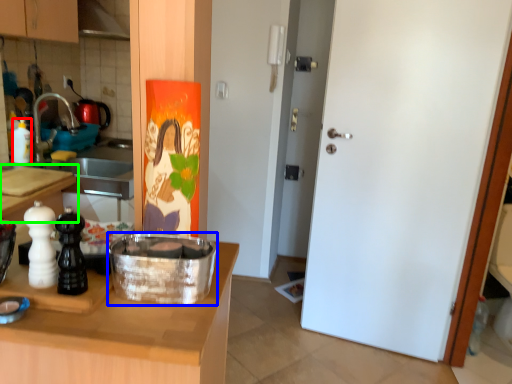
Question: Based on their relative distances, which object is nearer to bottle (highlighted by a red box)? Choose from kitchen appliance (highlighted by a blue box) and countertop (highlighted by a green box).

Choices:
 (A) kitchen appliance
 (B) countertop

Answer: (B)